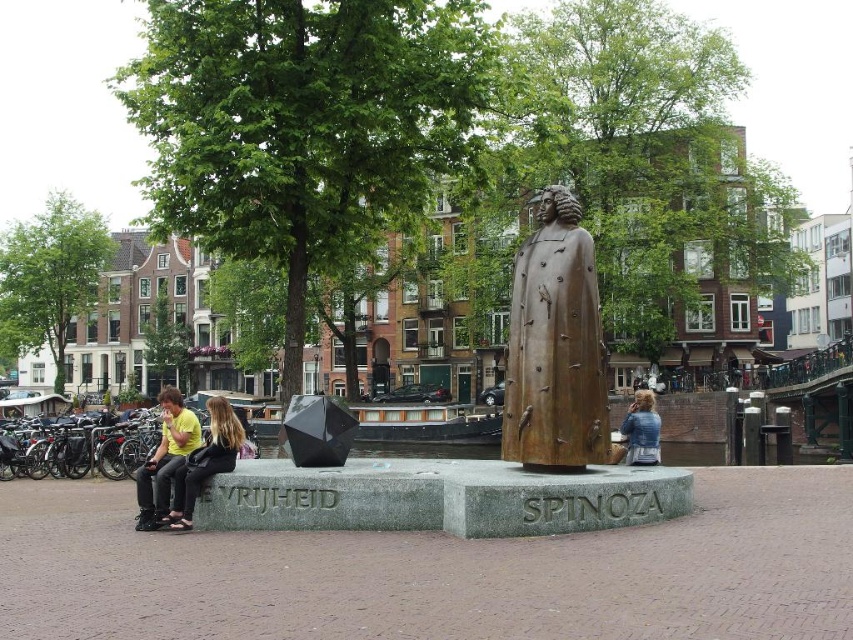
What do you see at coordinates (206, 461) in the screenshot? Image resolution: width=853 pixels, height=640 pixels. I see `matte black jacket at lower left` at bounding box center [206, 461].

Is point (236, 436) closer to camera compared to point (627, 456)?

Yes, point (236, 436) is in front of point (627, 456).

Where is `matte black jacket at lower left`? matte black jacket at lower left is located at coordinates (206, 461).

Who is lower down, yellow t-shirt at lower left or blue denim jacket at lower right?

Positioned lower is yellow t-shirt at lower left.

Does yellow t-shirt at lower left lie in front of blue denim jacket at lower right?

Yes, yellow t-shirt at lower left is in front of blue denim jacket at lower right.

Is point (160, 488) farther from camera compared to point (647, 403)?

No, it is not.

The width and height of the screenshot is (853, 640). What are the coordinates of `yellow t-shirt at lower left` in the screenshot? It's located at 165,460.

Does point (154, 465) lie in front of point (218, 440)?

No.

Between yellow t-shirt at lower left and matte black jacket at lower left, which one is positioned higher?

Positioned higher is matte black jacket at lower left.

Locate an element on the screen. yellow t-shirt at lower left is located at coordinates (165, 460).

Identify the location of yellow t-shirt at lower left. (165, 460).